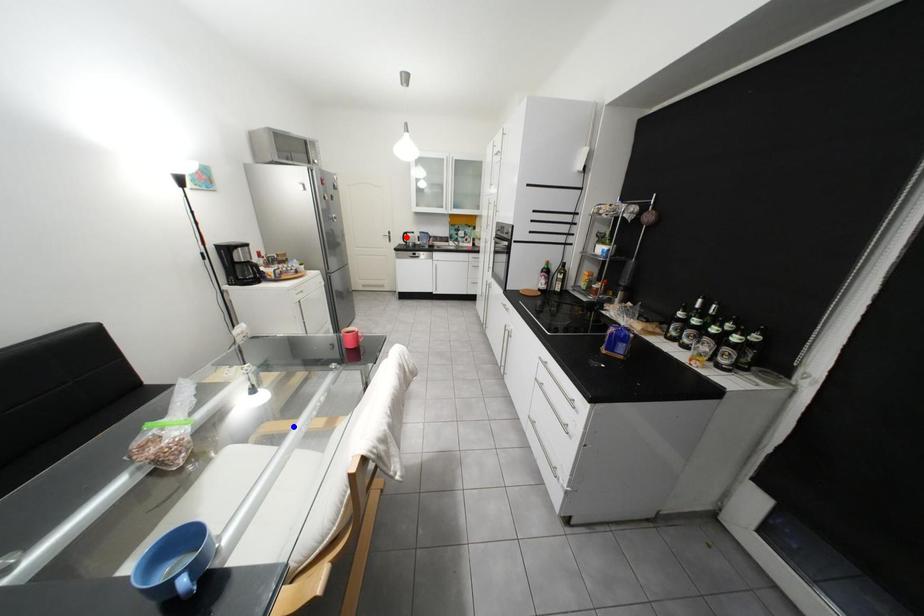
Question: Two points are marked on the image. Which point is closer to the camera?

Choices:
 (A) Blue point is closer.
 (B) Red point is closer.

Answer: (A)